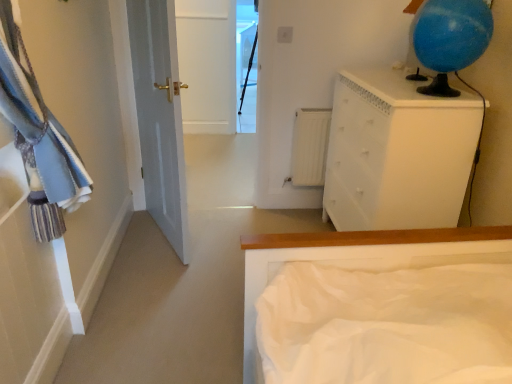
Question: From the image's perspective, is white matte radiator at center beneath white painted wood chest of drawers at upper right?

Choices:
 (A) no
 (B) yes

Answer: (A)

Question: Is the depth of white matte radiator at center greater than that of white painted wood chest of drawers at upper right?

Choices:
 (A) yes
 (B) no

Answer: (A)

Question: Considering the relative positions of white matte radiator at center and white painted wood chest of drawers at upper right in the image provided, is white matte radiator at center to the left of white painted wood chest of drawers at upper right from the viewer's perspective?

Choices:
 (A) yes
 (B) no

Answer: (A)

Question: Can you confirm if white matte radiator at center is smaller than white painted wood chest of drawers at upper right?

Choices:
 (A) no
 (B) yes

Answer: (B)

Question: Is white matte radiator at center placed right next to white painted wood chest of drawers at upper right?

Choices:
 (A) yes
 (B) no

Answer: (B)

Question: Does white matte radiator at center contain white painted wood chest of drawers at upper right?

Choices:
 (A) yes
 (B) no

Answer: (B)

Question: Is the depth of transparent glass window at center less than that of white matte bed at center?

Choices:
 (A) no
 (B) yes

Answer: (A)

Question: Is transparent glass window at center to the right of white matte bed at center from the viewer's perspective?

Choices:
 (A) yes
 (B) no

Answer: (B)

Question: Does transparent glass window at center turn towards white matte bed at center?

Choices:
 (A) yes
 (B) no

Answer: (B)

Question: From a real-world perspective, is transparent glass window at center positioned under white matte bed at center based on gravity?

Choices:
 (A) no
 (B) yes

Answer: (A)

Question: Is transparent glass window at center beside white matte bed at center?

Choices:
 (A) no
 (B) yes

Answer: (A)

Question: From a real-world perspective, is transparent glass window at center physically above white matte bed at center?

Choices:
 (A) yes
 (B) no

Answer: (A)

Question: Is transparent glass window at center a part of blue fabric laundry at left?

Choices:
 (A) yes
 (B) no

Answer: (B)